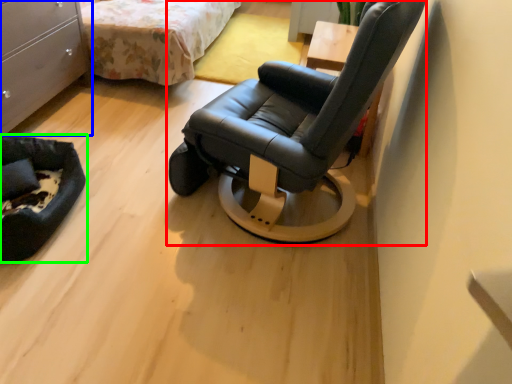
Question: Based on their relative distances, which object is nearer to chair (highlighted by a red box)? Choose from chest of drawers (highlighted by a blue box) and furniture (highlighted by a green box).

Choices:
 (A) chest of drawers
 (B) furniture

Answer: (B)